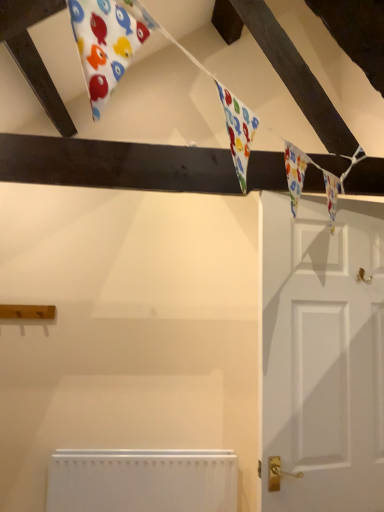
Describe the element at coordinates (142, 480) in the screenshot. I see `white matte radiator at lower center` at that location.

At what (x,y) coordinates should I click in order to perform the action: click on white matte radiator at lower center. Please return your answer as a coordinate pair (x, y). Image resolution: width=384 pixels, height=512 pixels. Looking at the image, I should click on (142, 480).

The image size is (384, 512). What do you see at coordinates (322, 354) in the screenshot?
I see `white matte door at right` at bounding box center [322, 354].

The width and height of the screenshot is (384, 512). I want to click on white matte door at right, so click(322, 354).

You are a GUI agent. You are given a task and a screenshot of the screen. Output one action in this format:
    pyautogui.click(x=<x>, y=<y>)
    Task: Click on the white matte radiator at lower center
    
    Given the screenshot: What is the action you would take?
    pyautogui.click(x=142, y=480)

Is white matte radiator at lower center to the right of white matte door at right from the viewer's perspective?

No.

In the image, is white matte radiator at lower center positioned in front of or behind white matte door at right?

Visually, white matte radiator at lower center is located behind white matte door at right.

Does point (140, 503) appear closer or farther from the camera than point (285, 488)?

Clearly, point (140, 503) is more distant from the camera than point (285, 488).

From the image's perspective, who appears lower, white matte radiator at lower center or white matte door at right?

white matte radiator at lower center.

From a real-world perspective, which object stands above the other?

In real-world perspective, white matte door at right is above.

Is white matte radiator at lower center thinner than white matte door at right?

No, white matte radiator at lower center is not thinner than white matte door at right.

Does white matte radiator at lower center have a lesser height compared to white matte door at right?

Yes, white matte radiator at lower center is shorter than white matte door at right.

Considering the sizes of objects white matte radiator at lower center and white matte door at right in the image provided, who is bigger, white matte radiator at lower center or white matte door at right?

white matte radiator at lower center is bigger.

Could white matte door at right be considered to be inside white matte radiator at lower center?

A: No, white matte door at right is not surrounded by white matte radiator at lower center.

Consider the image. Is white matte radiator at lower center next to white matte door at right?

No.

Does white matte radiator at lower center turn towards white matte door at right?

No, white matte radiator at lower center is not facing towards white matte door at right.

What's the angular difference between white matte radiator at lower center and white matte door at right's facing directions?

white matte radiator at lower center and white matte door at right are facing 173 degrees away from each other.

You are a GUI agent. You are given a task and a screenshot of the screen. Output one action in this format:
    pyautogui.click(x=<x>, y=<y>)
    Task: Click on the door in front of the white matte radiator at lower center
    This screenshot has height=512, width=384.
    Given the screenshot: What is the action you would take?
    pyautogui.click(x=322, y=354)

In the scene shown: Which is more to the left, white matte door at right or white matte radiator at lower center?

Positioned to the left is white matte radiator at lower center.

Is white matte door at right positioned in front of white matte radiator at lower center?

That is True.

Which is less distant, (357, 507) or (70, 487)?

The point (357, 507) is closer.

From the image's perspective, is white matte door at right below white matte radiator at lower center?

No, from the image's perspective, white matte door at right is not beneath white matte radiator at lower center.

From a real-world perspective, is white matte door at right positioned above or below white matte radiator at lower center?

From a real-world perspective, white matte door at right is physically above white matte radiator at lower center.

Between white matte door at right and white matte radiator at lower center, which one has smaller width?

With smaller width is white matte door at right.

Who is shorter, white matte door at right or white matte radiator at lower center?

white matte radiator at lower center.

Can you confirm if white matte door at right is smaller than white matte radiator at lower center?

Yes.

Would you say white matte door at right is inside or outside white matte radiator at lower center?

The correct answer is: outside.

Is white matte door at right directly adjacent to white matte radiator at lower center?

white matte door at right is not next to white matte radiator at lower center, and they're not touching.

Is white matte door at right facing towards white matte radiator at lower center?

Yes, white matte door at right is facing white matte radiator at lower center.

How different are the orientations of white matte door at right and white matte radiator at lower center in degrees?

173 degrees.

This screenshot has height=512, width=384. In order to click on radiator below the white matte door at right (from a real-world perspective) in this screenshot , I will do `click(142, 480)`.

The image size is (384, 512). Find the location of `radiator on the left of white matte door at right`. radiator on the left of white matte door at right is located at coordinates (142, 480).

The image size is (384, 512). I want to click on door in front of the white matte radiator at lower center, so click(x=322, y=354).